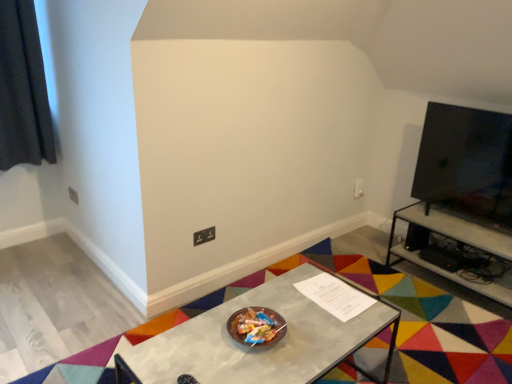
Question: Can you confirm if black fabric curtain at upper left is taller than matte black power outlet at lower center?

Choices:
 (A) no
 (B) yes

Answer: (B)

Question: Considering the relative positions of black fabric curtain at upper left and matte black power outlet at lower center in the image provided, is black fabric curtain at upper left to the right of matte black power outlet at lower center from the viewer's perspective?

Choices:
 (A) no
 (B) yes

Answer: (A)

Question: Is black fabric curtain at upper left bigger than matte black power outlet at lower center?

Choices:
 (A) no
 (B) yes

Answer: (B)

Question: Is black fabric curtain at upper left facing towards matte black power outlet at lower center?

Choices:
 (A) yes
 (B) no

Answer: (B)

Question: Is black fabric curtain at upper left oriented away from matte black power outlet at lower center?

Choices:
 (A) no
 (B) yes

Answer: (A)

Question: Is the position of black fabric curtain at upper left more distant than that of matte black power outlet at lower center?

Choices:
 (A) no
 (B) yes

Answer: (A)

Question: Is metallic gray table at center, arranged as the 2th table when viewed from the back, positioned far away from black fabric curtain at upper left?

Choices:
 (A) no
 (B) yes

Answer: (B)

Question: From the image's perspective, would you say metallic gray table at center, arranged as the 2th table when viewed from the back, is positioned over black fabric curtain at upper left?

Choices:
 (A) no
 (B) yes

Answer: (A)

Question: Is metallic gray table at center, marked as the 1th table in a front-to-back arrangement, thinner than black fabric curtain at upper left?

Choices:
 (A) no
 (B) yes

Answer: (A)

Question: Could you tell me if metallic gray table at center, which is the second table in right-to-left order, is turned towards black fabric curtain at upper left?

Choices:
 (A) no
 (B) yes

Answer: (A)

Question: Does metallic gray table at center, which is the second table in right-to-left order, touch black fabric curtain at upper left?

Choices:
 (A) no
 (B) yes

Answer: (A)

Question: Can you confirm if metallic gray table at center, which is the second table in right-to-left order, is smaller than black fabric curtain at upper left?

Choices:
 (A) yes
 (B) no

Answer: (B)

Question: Is metallic gray table at right, the second table when ordered from left to right, outside of black fabric curtain at upper left?

Choices:
 (A) yes
 (B) no

Answer: (A)